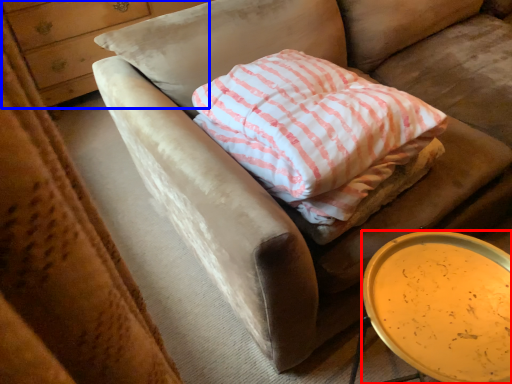
Question: Which object appears closest to the camera in this image, table (highlighted by a red box) or dresser (highlighted by a blue box)?

Choices:
 (A) table
 (B) dresser

Answer: (A)